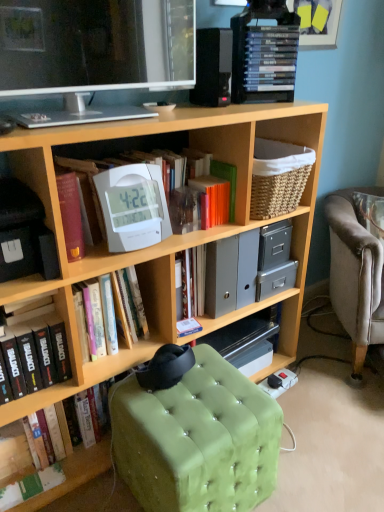
The width and height of the screenshot is (384, 512). I want to click on vacant area that lies to the right of green paper book at lower left, acting as the 5th book starting from the top, so click(x=93, y=484).